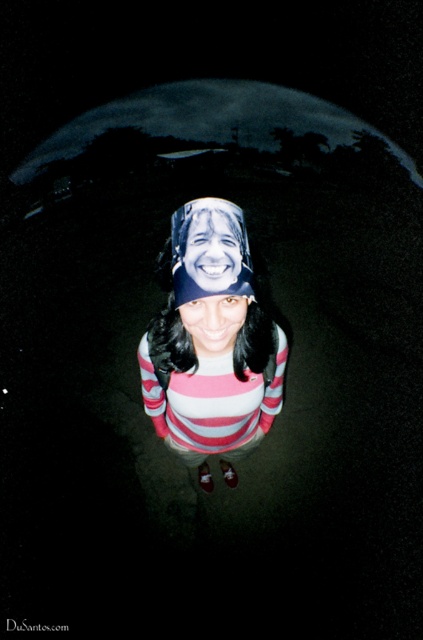
Question: Estimate the real-world distances between objects in this image. Which object is farther from the smooth plastic face at center?

Choices:
 (A) matte striped shirt at center
 (B) striped cotton shirt at center

Answer: (B)

Question: Does striped cotton shirt at center have a lesser width compared to matte striped shirt at center?

Choices:
 (A) no
 (B) yes

Answer: (A)

Question: Is striped cotton shirt at center to the right of smooth plastic face at center from the viewer's perspective?

Choices:
 (A) yes
 (B) no

Answer: (B)

Question: Estimate the real-world distances between objects in this image. Which object is closer to the striped cotton shirt at center?

Choices:
 (A) smooth plastic face at center
 (B) matte striped shirt at center

Answer: (B)

Question: Can you confirm if smooth plastic face at center is wider than matte striped shirt at center?

Choices:
 (A) no
 (B) yes

Answer: (A)

Question: Which of these objects is positioned closest to the striped cotton shirt at center?

Choices:
 (A) matte striped shirt at center
 (B) smooth plastic face at center

Answer: (A)